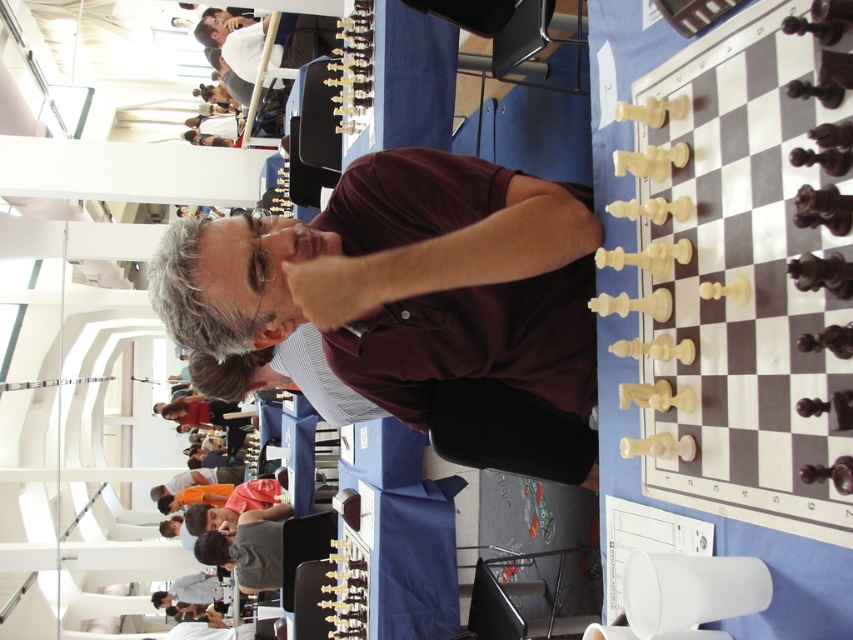
Does maroon shirt at center have a lesser height compared to matte black chess set at upper center?

No, maroon shirt at center is not shorter than matte black chess set at upper center.

Which is behind, point (444, 237) or point (241, 26)?

The point (241, 26) is behind.

Where is `maroon shirt at center`? maroon shirt at center is located at coordinates (418, 301).

Locate an element on the screen. The width and height of the screenshot is (853, 640). maroon shirt at center is located at coordinates (418, 301).